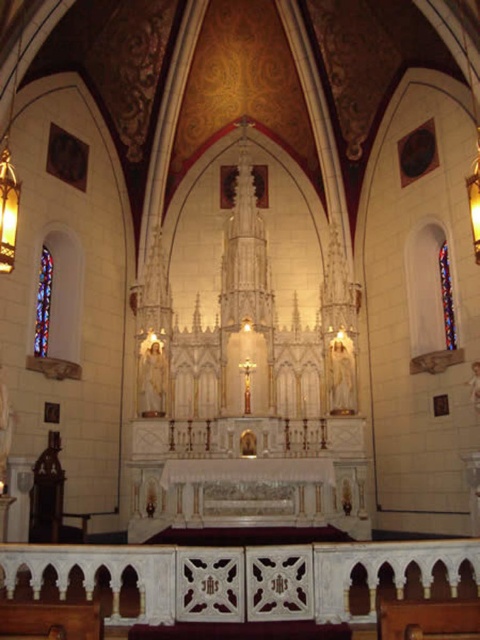
You are an architect designing a new church and want to ensure the stained glass window at left is visible from the entrance. The entrance is 195.90 feet away from the window. Will the window be visible from there?

The stained glass window at left is 195.90 feet away from the entrance. Since the distance is within the typical visibility range for such large architectural elements, the window will likely be visible from the entrance.

You are an architect inspecting the church. You notice two stained glass windows, the stained glass window at left and the stained glass window at right. Which one is located lower in the church?

The stained glass window at left is positioned under the stained glass window at right, so it is located lower in the church.